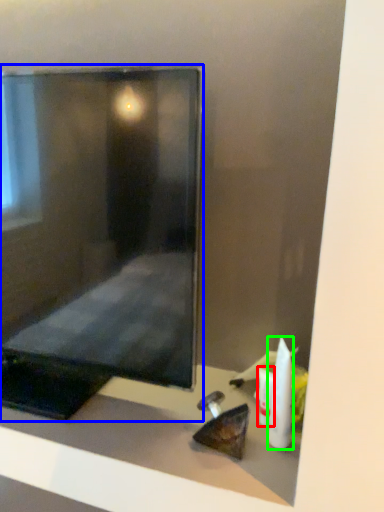
Question: Considering the real-world distances, which object is farthest from toiletry (highlighted by a red box)? computer monitor (highlighted by a blue box) or toiletry (highlighted by a green box)?

Choices:
 (A) computer monitor
 (B) toiletry

Answer: (A)